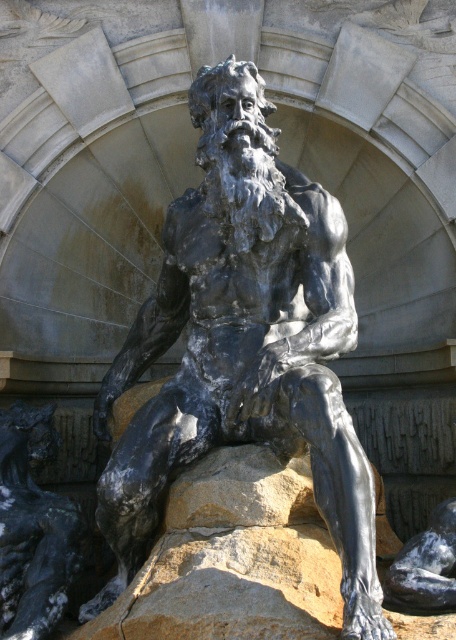
Question: Which of the following is the farthest from the observer?

Choices:
 (A) shiny black stone figure at lower left
 (B) shiny bronze statue at center

Answer: (A)

Question: Which point is closer to the camera?

Choices:
 (A) (237, 154)
 (B) (434, 582)

Answer: (B)

Question: Is shiny bronze statue at center positioned behind shiny black stone statue at center?

Choices:
 (A) yes
 (B) no

Answer: (B)

Question: Which of the following is the farthest from the observer?

Choices:
 (A) shiny black stone statue at center
 (B) shiny black stone figure at lower left
 (C) shiny bronze statue at center

Answer: (B)

Question: Does shiny bronze statue at center have a greater width compared to shiny black stone figure at lower left?

Choices:
 (A) no
 (B) yes

Answer: (B)

Question: Does shiny bronze statue at center appear on the right side of shiny black stone figure at lower left?

Choices:
 (A) yes
 (B) no

Answer: (A)